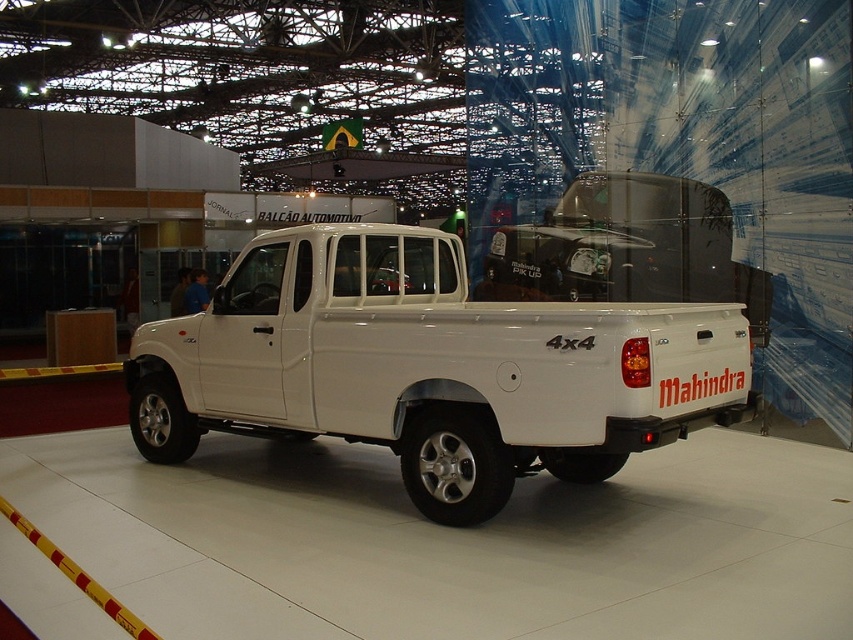
Based on the photo, between white glossy pickup truck at center and white matte truck at center, which one appears on the left side from the viewer's perspective?

white glossy pickup truck at center

Measure the distance between white glossy pickup truck at center and white matte truck at center.

white glossy pickup truck at center is 12.47 feet away from white matte truck at center.

The image size is (853, 640). In order to click on white glossy pickup truck at center in this screenshot , I will do `click(428, 365)`.